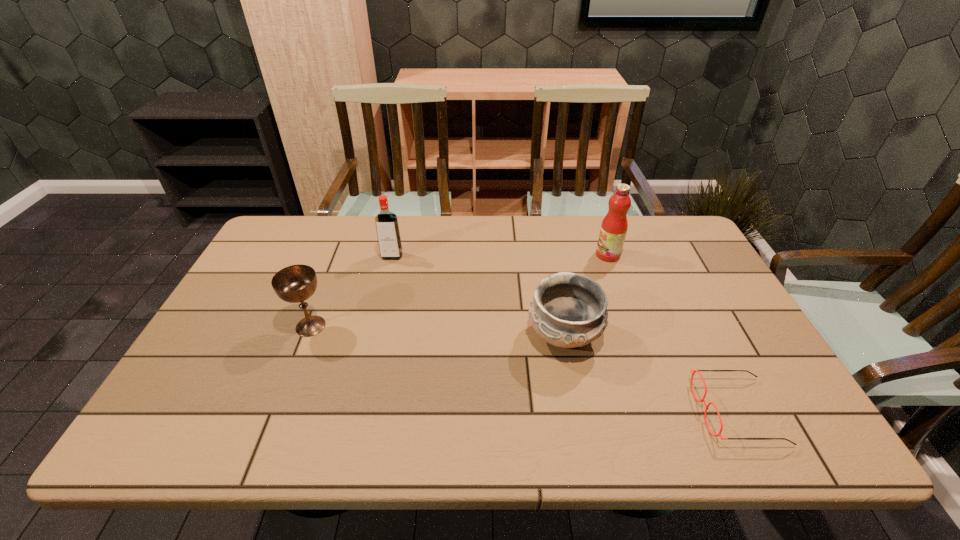
Find the location of a particular element. vacant space located on the front and back of the vodka is located at coordinates (375, 327).

Find the location of a particular element. free space located on the right of the leftmost object is located at coordinates (417, 326).

Where is `blank area located 0.290m on the left of the second shortest object`? This screenshot has height=540, width=960. blank area located 0.290m on the left of the second shortest object is located at coordinates (415, 336).

The height and width of the screenshot is (540, 960). Find the location of `free spot located on the front-facing side of the shortest object`. free spot located on the front-facing side of the shortest object is located at coordinates (623, 411).

This screenshot has width=960, height=540. In order to click on vacant space situated 0.060m on the front-facing side of the shortest object in this screenshot , I will do pyautogui.click(x=673, y=411).

This screenshot has height=540, width=960. In order to click on free location located 0.150m on the front-facing side of the shortest object in this screenshot , I will do `click(632, 411)`.

What are the coordinates of `fruit juice positioned at the far edge` in the screenshot? It's located at (614, 226).

Identify the location of vodka situated at the far edge. The image size is (960, 540). (388, 234).

The image size is (960, 540). I want to click on object at the near edge, so click(x=702, y=400).

Find the location of a particular element. object positioned at the right edge is located at coordinates (702, 400).